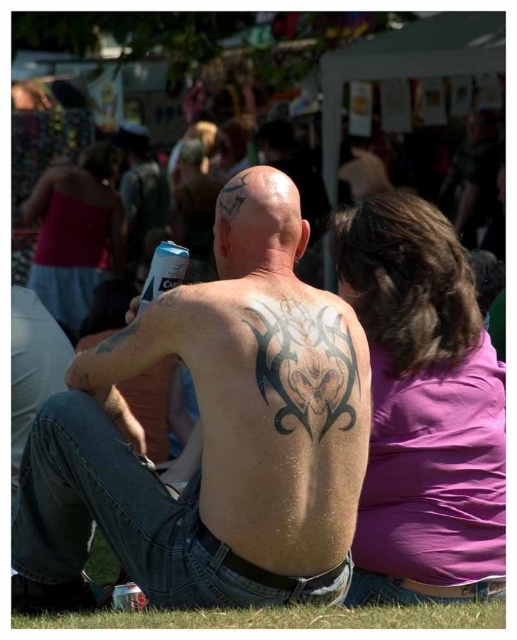
Identify the location of dark skin tattoo at center. The height and width of the screenshot is (640, 517). (210, 435).

Is dark skin tattoo at center to the right of matte pink tank top at upper left from the viewer's perspective?

Correct, you'll find dark skin tattoo at center to the right of matte pink tank top at upper left.

Which is behind, point (303, 234) or point (50, 188)?

The point (50, 188) is behind.

Where is `dark skin tattoo at center`? The height and width of the screenshot is (640, 517). dark skin tattoo at center is located at coordinates (210, 435).

Between dark skin tattoo at center and black tattoo at upper back, which one has more height?

With more height is dark skin tattoo at center.

Does dark skin tattoo at center appear on the left side of black tattoo at upper back?

Yes, dark skin tattoo at center is to the left of black tattoo at upper back.

At what (x,y) coordinates should I click in order to perform the action: click on dark skin tattoo at center. Please return your answer as a coordinate pair (x, y). Looking at the image, I should click on (210, 435).

Find the location of a particular element. Image resolution: width=517 pixels, height=640 pixels. dark skin tattoo at center is located at coordinates click(x=210, y=435).

Based on the photo, does matte pink tank top at upper left have a lesser height compared to green grass at lower center?

Incorrect, matte pink tank top at upper left's height does not fall short of green grass at lower center's.

Can you confirm if matte pink tank top at upper left is positioned below green grass at lower center?

No.

Where is `matte pink tank top at upper left`? matte pink tank top at upper left is located at coordinates (75, 232).